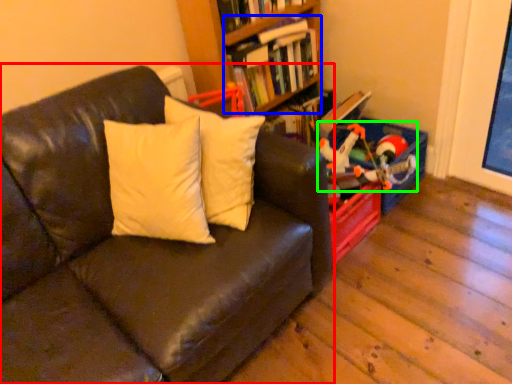
Question: Based on their relative distances, which object is nearer to studio couch (highlighted by a red box)? Choose from book (highlighted by a blue box) and toy (highlighted by a green box).

Choices:
 (A) book
 (B) toy

Answer: (B)